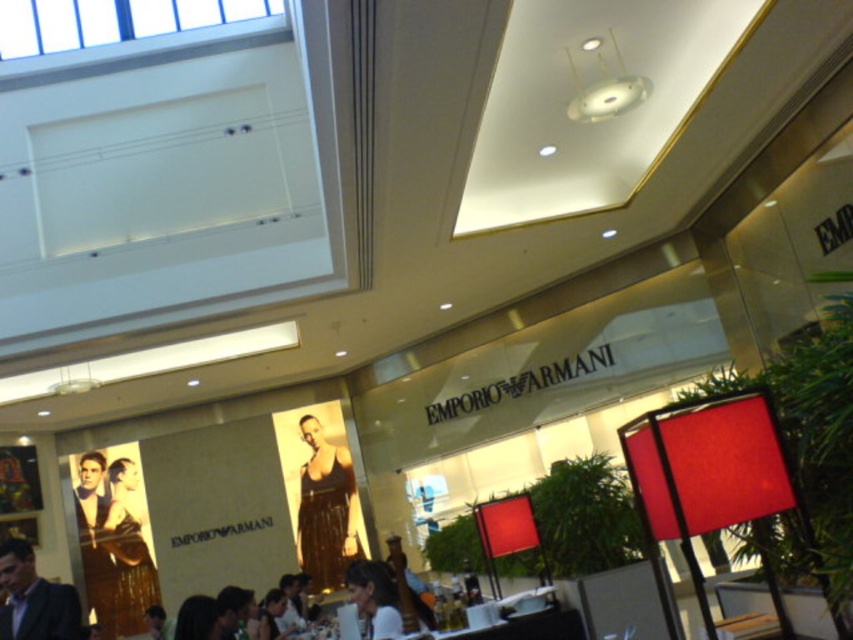
Question: From the image, what is the correct spatial relationship of shiny gold dress at center in relation to dark suit at lower left?

Choices:
 (A) left
 (B) right

Answer: (B)

Question: Which point appears farthest from the camera in this image?

Choices:
 (A) (358, 561)
 (B) (334, 524)

Answer: (B)

Question: Where is shiny gold dress at center located in relation to dark suit at lower left in the image?

Choices:
 (A) right
 (B) left

Answer: (A)

Question: Does shiny gold dress at center appear under matte black shirt at center?

Choices:
 (A) no
 (B) yes

Answer: (B)

Question: Which of these objects is positioned farthest from the dark suit at lower left?

Choices:
 (A) matte black shirt at center
 (B) shiny gold dress at center

Answer: (B)

Question: Which point is farther to the camera?

Choices:
 (A) shiny gold dress at center
 (B) matte black shirt at center

Answer: (A)